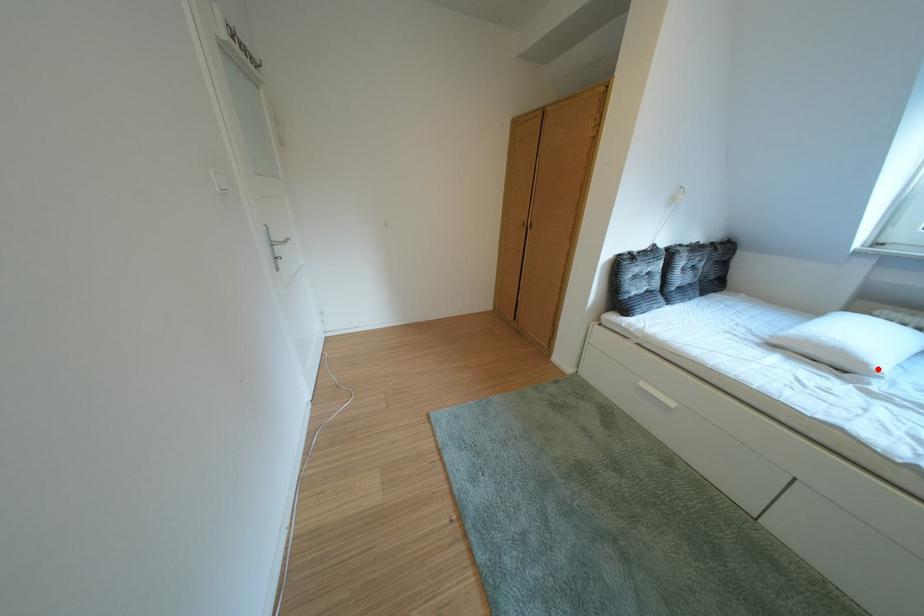
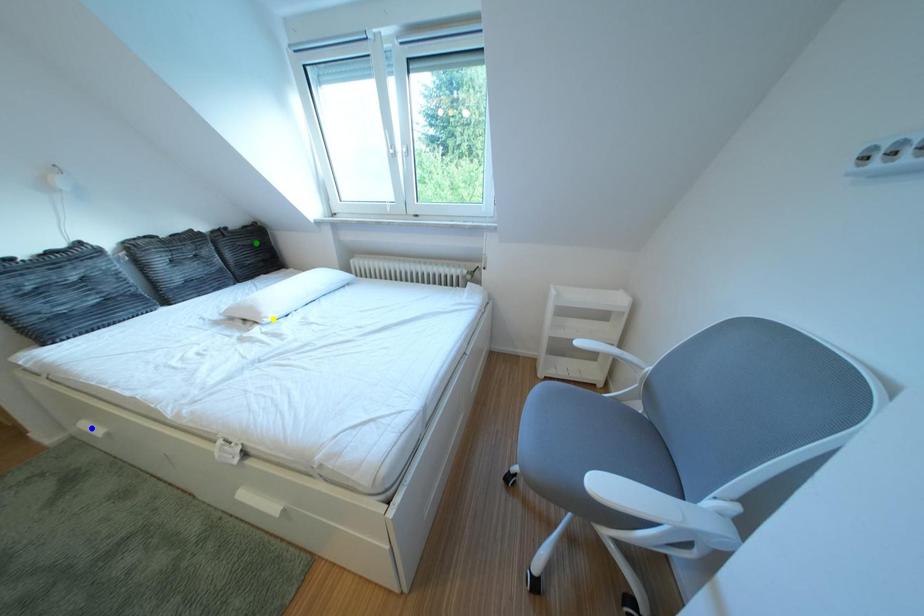
Question: I am providing you with two images of the same scene from different viewpoints. A red point is marked on the first image. You are given multiple points on the second image. Which point in image 2 represents the same 3d spot as the red point in image 1?

Choices:
 (A) blue point
 (B) green point
 (C) yellow point

Answer: (C)